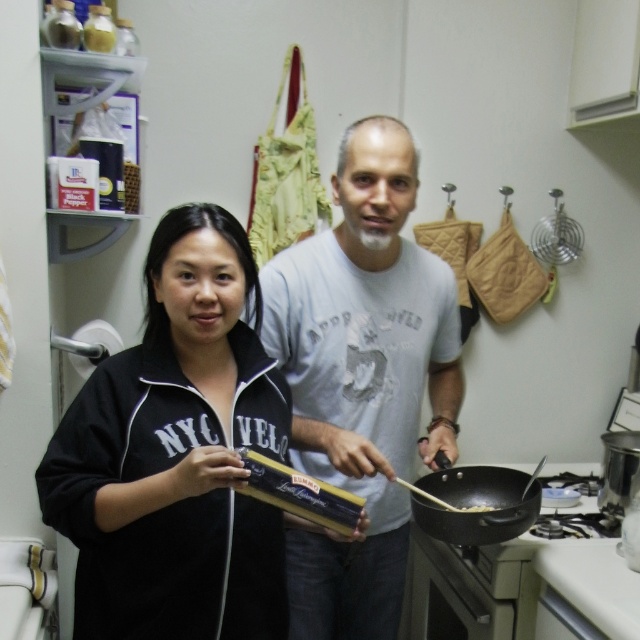
You are standing in the kitchen and want to place a small plant between the two points, point [209,604] and point [490,531]. Which point should the plant be closer to in order to be closer to you?

The plant should be closer to point [209,604] because it is closer to the viewer than point [490,531].